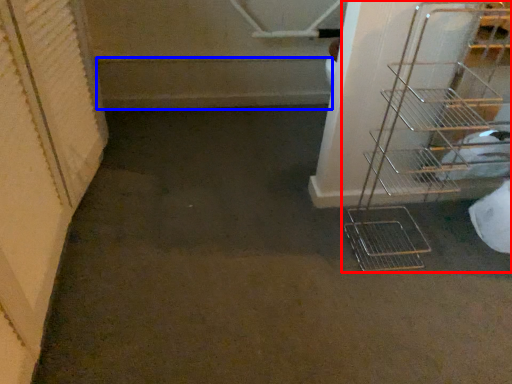
Question: Which object appears closest to the camera in this image, shelf (highlighted by a red box) or stairs (highlighted by a blue box)?

Choices:
 (A) shelf
 (B) stairs

Answer: (A)